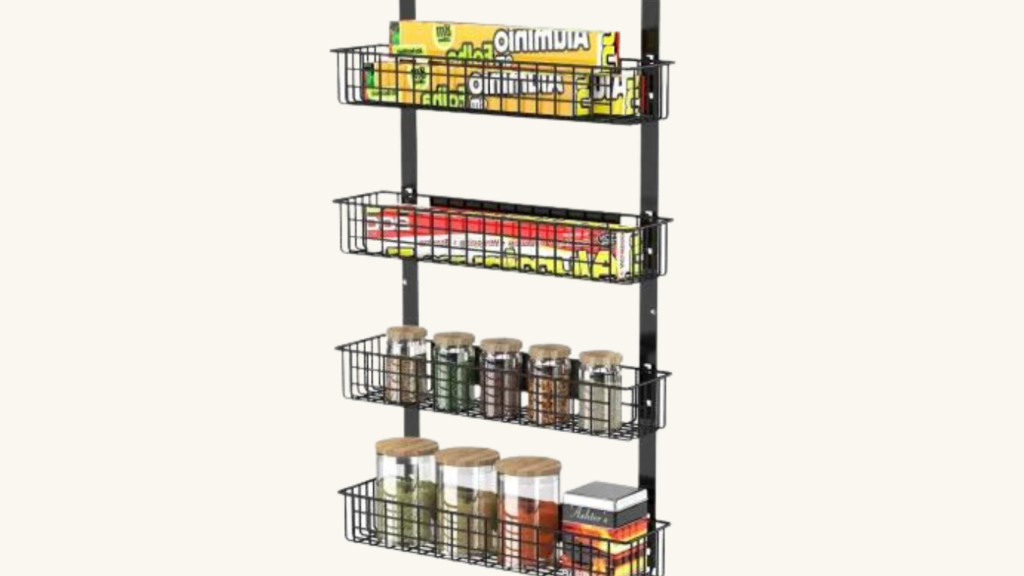
This screenshot has height=576, width=1024. Find the location of `top shelf`. top shelf is located at coordinates (465, 59).